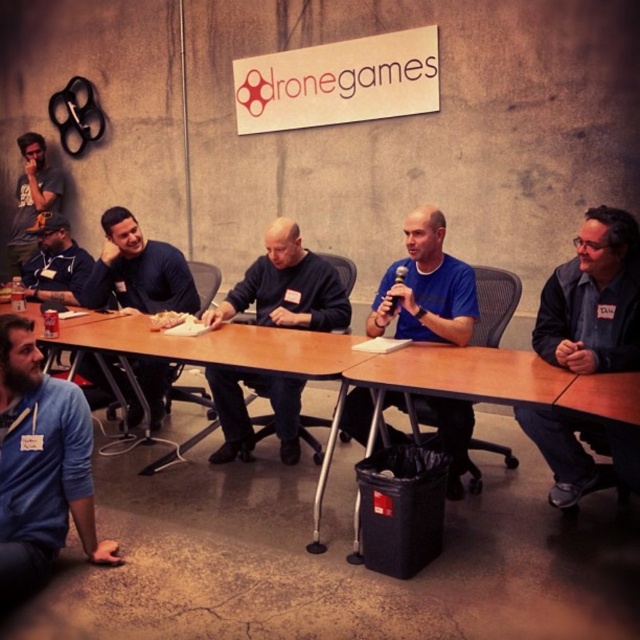
Can you confirm if blue sweater at lower left is shorter than blue matte shirt at center?

In fact, blue sweater at lower left may be taller than blue matte shirt at center.

Does point (22, 362) come closer to viewer compared to point (458, 280)?

Yes, point (22, 362) is in front of point (458, 280).

Who is more forward, (x=83, y=435) or (x=445, y=268)?

Positioned in front is point (x=83, y=435).

This screenshot has width=640, height=640. Find the location of `blue sweater at lower left`. blue sweater at lower left is located at coordinates (40, 467).

Can you confirm if blue matte shirt at center is shorter than matte blue sweater at left?

No.

Between blue matte shirt at center and matte blue sweater at left, which one appears on the left side from the viewer's perspective?

From the viewer's perspective, matte blue sweater at left appears more on the left side.

Which is in front, point (387, 291) or point (115, 291)?

Point (387, 291) is in front.

Find the location of a particular element. Image resolution: width=640 pixels, height=640 pixels. blue matte shirt at center is located at coordinates (426, 288).

Which of these two, blue sweater at lower left or matte blue sweater at left, stands taller?

With more height is blue sweater at lower left.

Does blue sweater at lower left lie behind matte blue sweater at left?

No, it is not.

This screenshot has height=640, width=640. Identify the location of blue sweater at lower left. (40, 467).